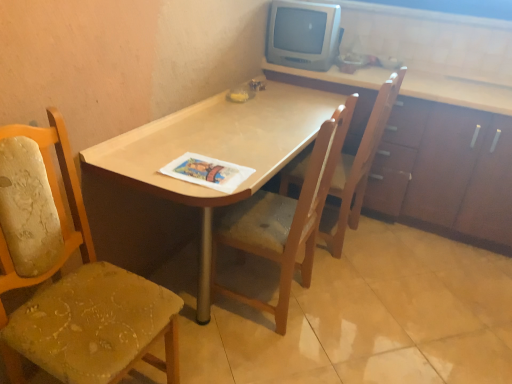
You are a GUI agent. You are given a task and a screenshot of the screen. Output one action in this format:
    pyautogui.click(x=<x>, y=<y>)
    Task: Click on the free space in front of wooden chair at center, which is the 2th chair from left to right
    
    Given the screenshot: What is the action you would take?
    [x=275, y=361]